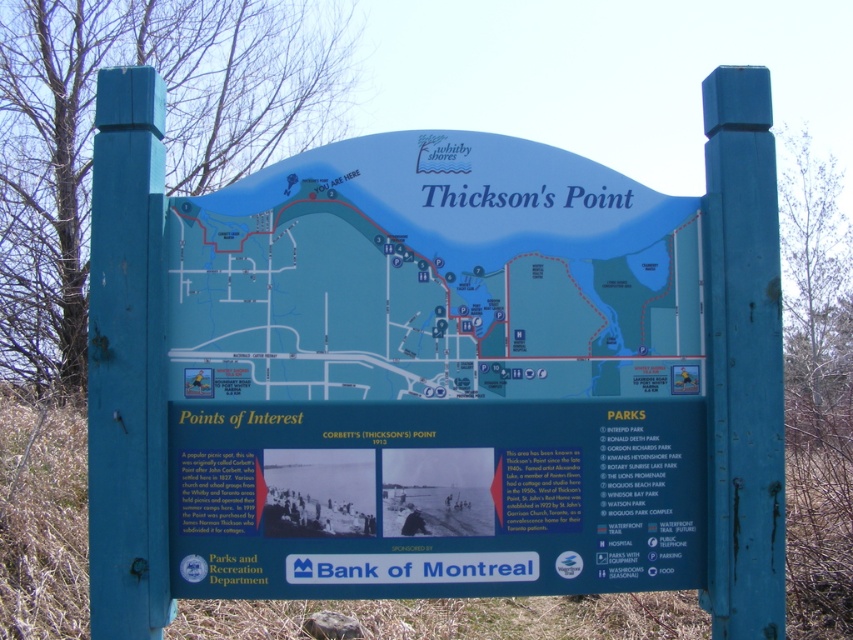
You are looking at the Thickson Point signboard. There is a blue plastic map at center and a matte blue signboard at center. Which object is positioned higher on the signboard?

The blue plastic map at center is located above the matte blue signboard at center, so it is positioned higher.

You are holding a small magnifying glass and want to examine the details of the blue plastic map at center and the matte blue signboard at center. Which object should you focus your magnifying glass on to see more details without moving closer?

The matte blue signboard at center is smaller than the blue plastic map at center, so focusing the magnifying glass on the matte blue signboard at center would allow you to see more details without needing to move closer.